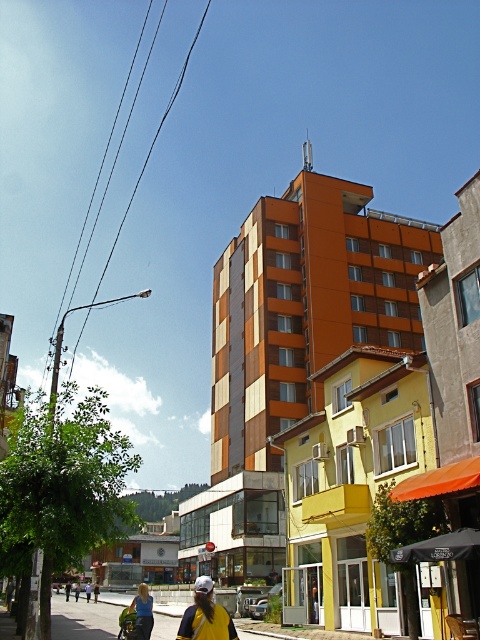
Where is `yellow fabric cap at center`? yellow fabric cap at center is located at coordinates (205, 616).

In the scene shown: Who is lower down, yellow fabric cap at center or blue fabric shirt at lower center?

blue fabric shirt at lower center is lower down.

Between point (204, 577) and point (142, 616), which one is positioned behind?

The point (204, 577) is more distant.

Where is `yellow fabric cap at center`? This screenshot has width=480, height=640. yellow fabric cap at center is located at coordinates (205, 616).

Does point (192, 621) come farther from viewer compared to point (92, 586)?

No, it is not.

Is yellow fabric cap at center positioned before yellow fabric umbrella at center?

Yes.

What do you see at coordinates (205, 616) in the screenshot?
I see `yellow fabric cap at center` at bounding box center [205, 616].

Where is `yellow fabric cap at center`? yellow fabric cap at center is located at coordinates tap(205, 616).

Can you confirm if blue fabric shirt at lower center is positioned above yellow fabric umbrella at center?

Yes.

Does blue fabric shirt at lower center appear on the right side of yellow fabric umbrella at center?

Indeed, blue fabric shirt at lower center is positioned on the right side of yellow fabric umbrella at center.

At what (x,y) coordinates should I click in order to perform the action: click on blue fabric shirt at lower center. Please return your answer as a coordinate pair (x, y). Looking at the image, I should click on (143, 611).